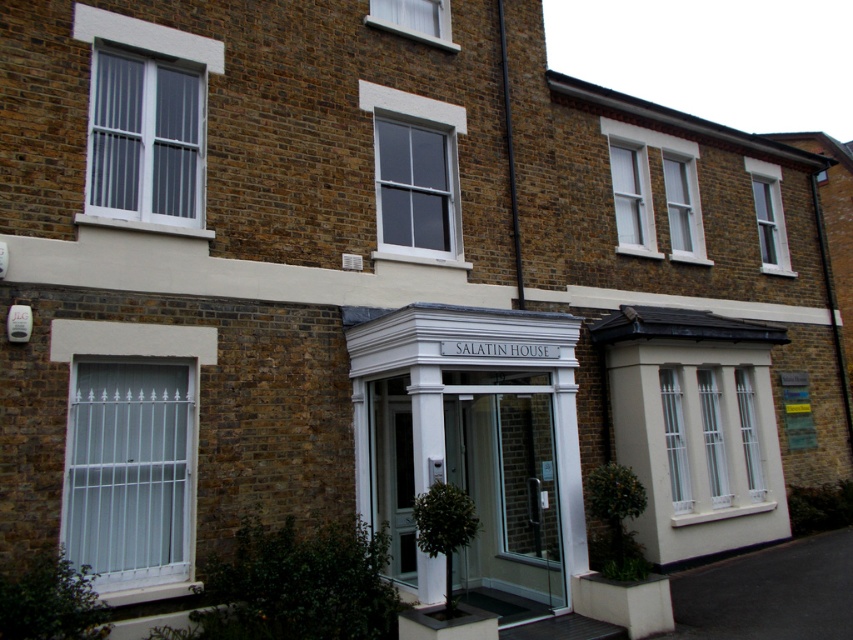
Question: Does transparent glass door at center have a lesser width compared to white glossy pillar at center?

Choices:
 (A) yes
 (B) no

Answer: (B)

Question: Can you confirm if transparent glass door at center is smaller than white glossy pillar at center?

Choices:
 (A) no
 (B) yes

Answer: (A)

Question: Which point appears closest to the camera in this image?

Choices:
 (A) (442, 579)
 (B) (538, 534)

Answer: (A)

Question: Can you confirm if transparent glass door at center is positioned above white glossy pillar at center?

Choices:
 (A) no
 (B) yes

Answer: (A)